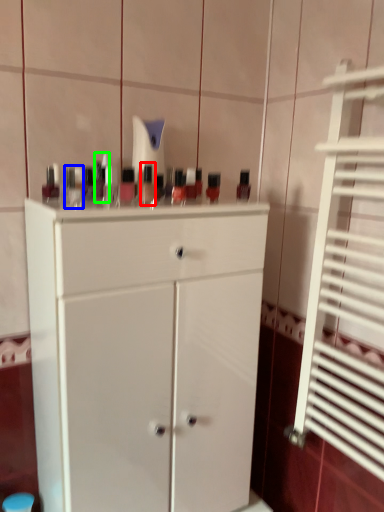
Question: Which object is positioned farthest from mouthwash (highlighted by a red box)? Select from toiletry (highlighted by a blue box) and toiletry (highlighted by a green box).

Choices:
 (A) toiletry
 (B) toiletry

Answer: (A)